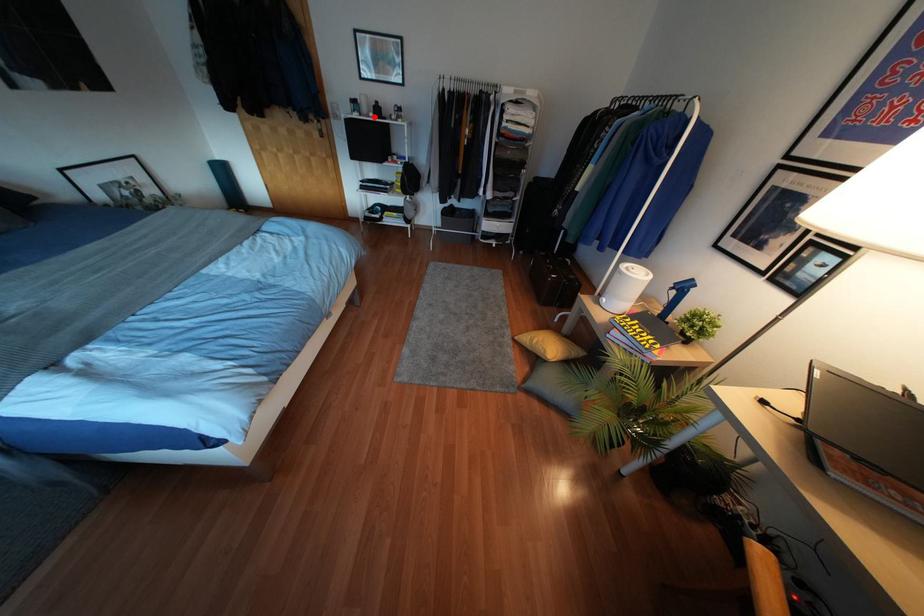
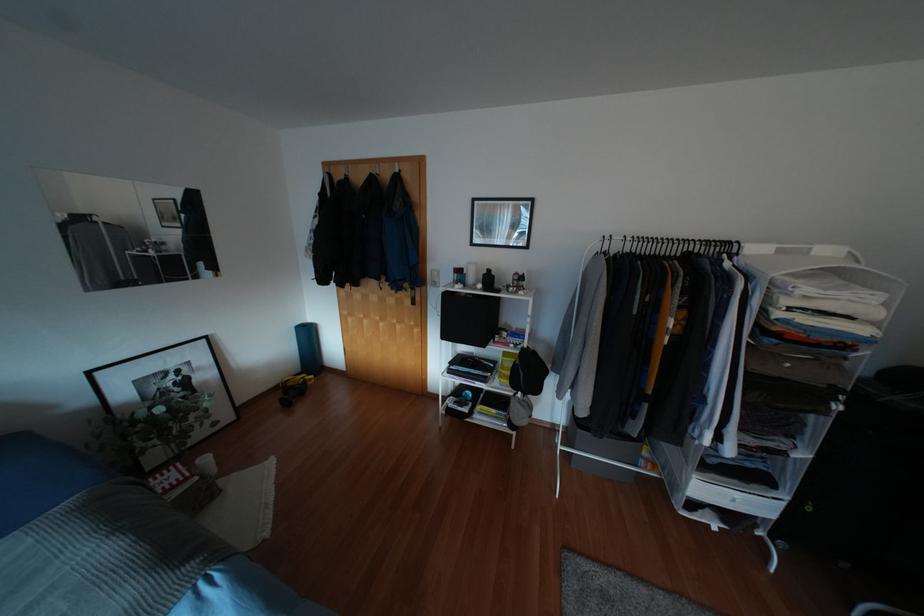
Question: I am providing you with two images of the same scene from different viewpoints. Image1 has a red point marked. In image2, the corresponding 3D location appears at what relative position? Reply with the corresponding letter.

Choices:
 (A) Closer
 (B) Farther

Answer: (B)